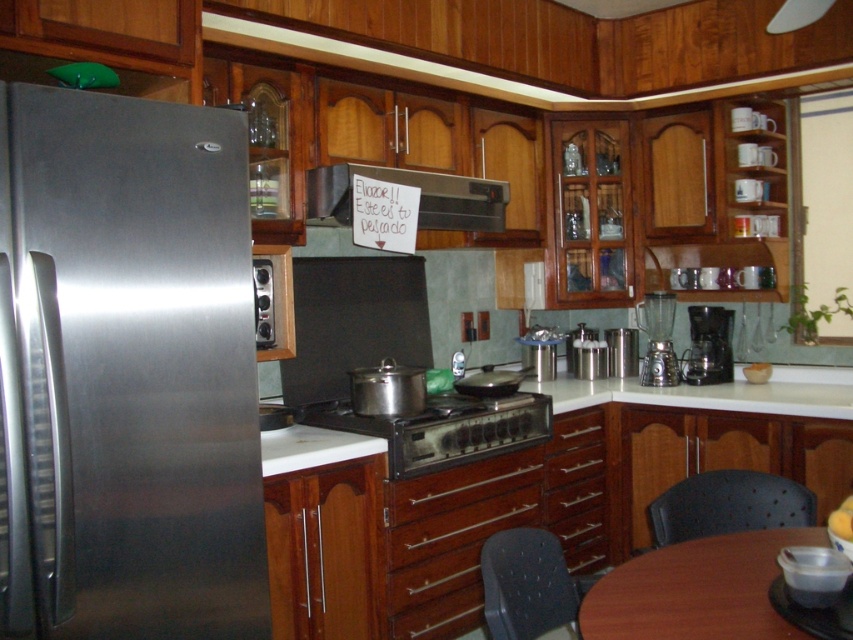
Question: Can you confirm if black mesh chair at lower right is wider than satin black stove at center?

Choices:
 (A) yes
 (B) no

Answer: (A)

Question: Which point is closer to the camera?

Choices:
 (A) white glossy countertop at center
 (B) stainless steel refrigerator at left
 (C) black plastic coffee maker at right

Answer: (B)

Question: Which point is farther to the camera?

Choices:
 (A) (500, 577)
 (B) (265, 298)
 (C) (430, 417)
 (D) (451, 182)

Answer: (D)

Question: Which object appears farthest from the camera in this image?

Choices:
 (A) stainless steel refrigerator at left
 (B) satin black stove at center
 (C) metallic silver exhaust hood at upper center

Answer: (C)

Question: Can you confirm if stainless steel refrigerator at left is positioned to the left of white glossy countertop at center?

Choices:
 (A) yes
 (B) no

Answer: (A)

Question: Where is stainless steel refrigerator at left located in relation to white glossy countertop at center in the image?

Choices:
 (A) below
 (B) above

Answer: (B)